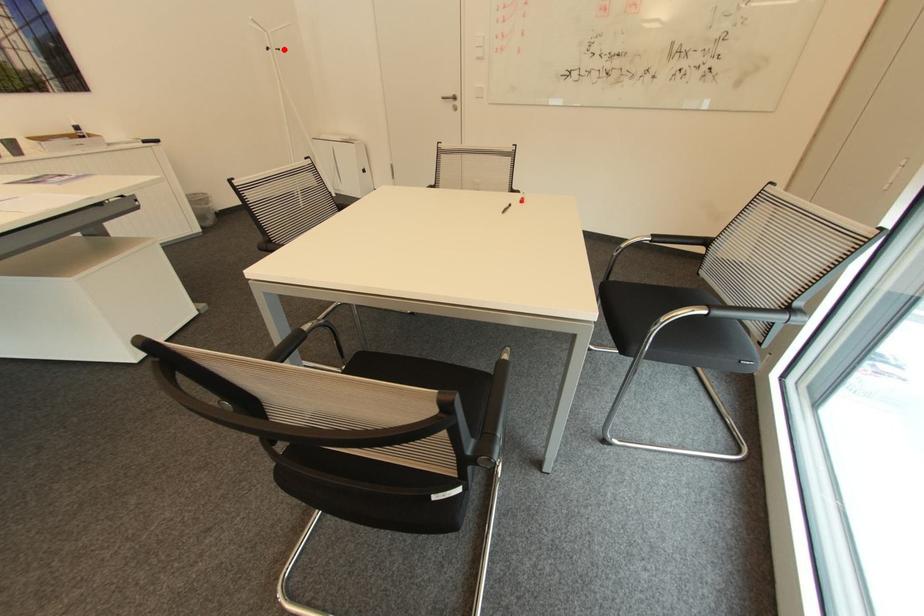
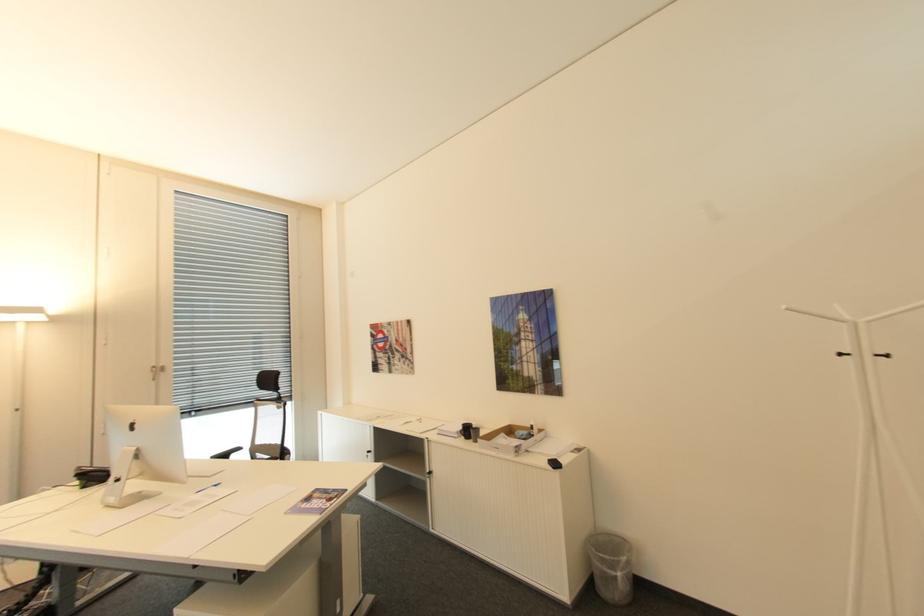
Where in the second image is the point corresponding to the highlighted location from the first image?

(894, 355)